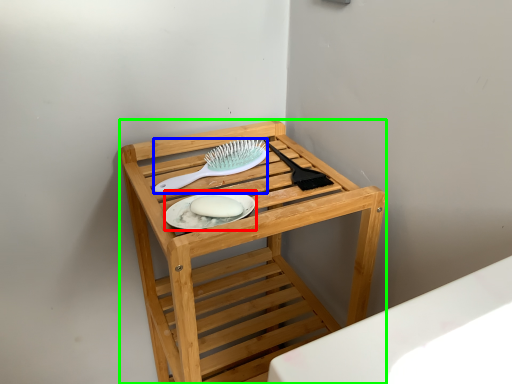
Question: Which is nearer to the platter (highlighted by a red box)? brush (highlighted by a blue box) or furniture (highlighted by a green box).

Choices:
 (A) brush
 (B) furniture

Answer: (A)